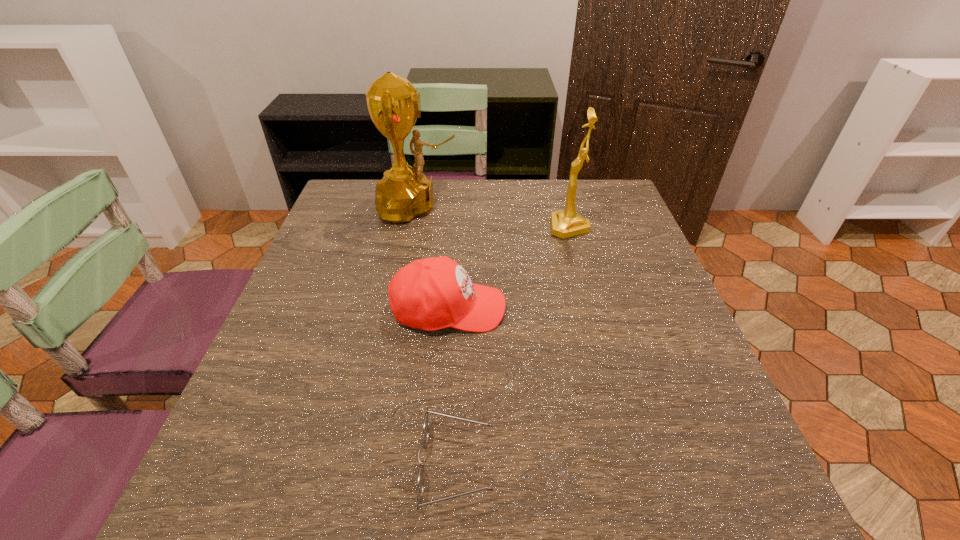
The width and height of the screenshot is (960, 540). What are the coordinates of `free spot located 0.130m on the front-facing side of the shorter award` in the screenshot? It's located at (501, 227).

Identify the location of blank area located on the front panel of the second nearest object. (542, 309).

What are the coordinates of `free space located on the front-facing side of the nearest object` in the screenshot? It's located at (626, 465).

At what (x,y) coordinates should I click in order to perform the action: click on object at the near edge. Please return your answer as a coordinate pair (x, y). Image resolution: width=960 pixels, height=540 pixels. Looking at the image, I should click on (425, 427).

Where is `object that is at the left edge`? This screenshot has width=960, height=540. object that is at the left edge is located at coordinates (393, 103).

Image resolution: width=960 pixels, height=540 pixels. I want to click on object that is at the right edge, so click(x=564, y=224).

Locate an element on the screen. This screenshot has width=960, height=540. object located in the far left corner section of the desktop is located at coordinates pyautogui.click(x=393, y=103).

Find the location of a particular element. The image size is (960, 540). object situated at the far right corner is located at coordinates (564, 224).

Identify the location of vacant region at the left edge of the desktop. Image resolution: width=960 pixels, height=540 pixels. (233, 464).

Where is `vacant point at the right edge`? vacant point at the right edge is located at coordinates (613, 310).